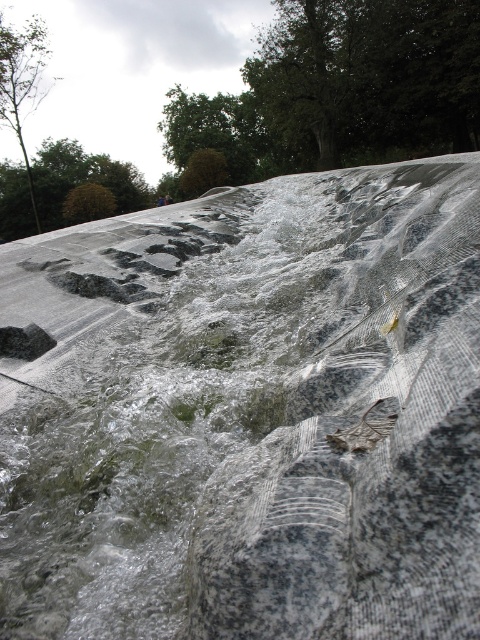
Can you confirm if green leafy tree at upper center is smaller than green leafy tree at upper left?

No.

From the picture: How distant is green leafy tree at upper center from green leafy tree at upper left?

green leafy tree at upper center and green leafy tree at upper left are 55.62 feet apart.

Is point (371, 109) positioned after point (8, 49)?

Yes, it is.

Identify the location of green leafy tree at upper center. The height and width of the screenshot is (640, 480). (340, 90).

Can you confirm if brown leafy tree at upper left is taller than green leafy tree at upper left?

No, brown leafy tree at upper left is not taller than green leafy tree at upper left.

Does brown leafy tree at upper left have a larger size compared to green leafy tree at upper left?

No.

The width and height of the screenshot is (480, 640). What do you see at coordinates (82, 179) in the screenshot?
I see `brown leafy tree at upper left` at bounding box center [82, 179].

At what (x,y) coordinates should I click in order to perform the action: click on brown leafy tree at upper left. Please return your answer as a coordinate pair (x, y). Looking at the image, I should click on (82, 179).

Is green leafy tree at upper center thinner than brown leafy tree at upper left?

No, green leafy tree at upper center is not thinner than brown leafy tree at upper left.

Is green leafy tree at upper center above brown leafy tree at upper left?

Indeed, green leafy tree at upper center is positioned over brown leafy tree at upper left.

Is point (448, 109) positioned behind point (95, 170)?

No.

Locate an element on the screen. green leafy tree at upper center is located at coordinates (340, 90).